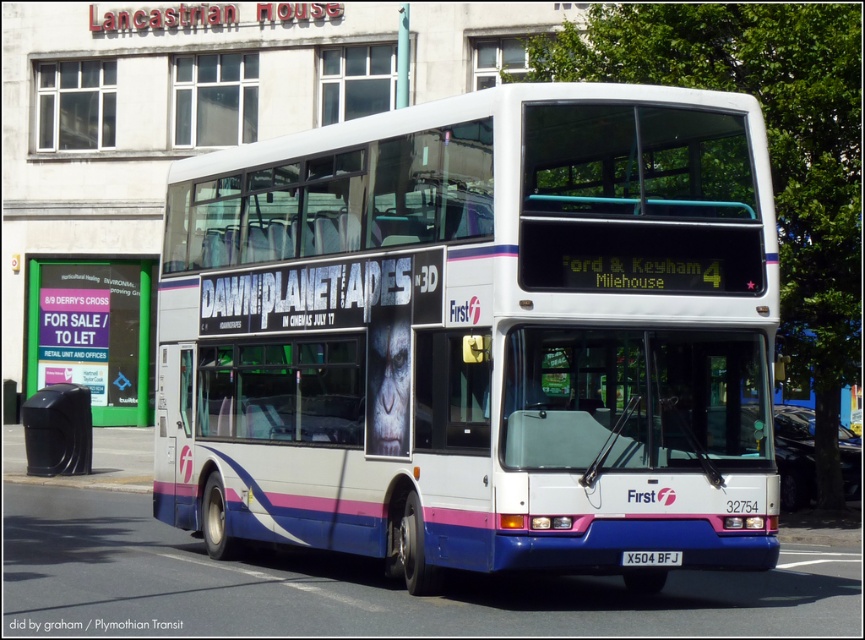
You are a photographer standing at the lower left corner of the scene. You want to take a photo of the white glossy decker bus at center without the black plastic trash can at lower left appearing in the frame. Is it possible to do so by moving your position upwards?

The white glossy decker bus at center is located above the black plastic trash can at lower left. Since you are standing at the lower left corner, moving upwards would allow you to position yourself where the trash can is no longer in the frame, making it possible to capture the bus without the trash can appearing.

You are standing in front of the double decker bus and want to touch both points on the bus. Which point should you reach first, point at (x=439, y=410) or point at (x=677, y=554)?

Point at (x=439, y=410) is closer to you than point at (x=677, y=554), so you should reach point at (x=439, y=410) first.

Based on the photo, you are a photographer trying to capture the white glossy decker bus at center and the white plastic license plate at center in a single shot. Which object should you zoom in on to ensure both are clearly visible in the frame?

The white glossy decker bus at center is thinner than the white plastic license plate at center, so you should zoom in on the white plastic license plate at center to ensure both objects are clearly visible in the frame.